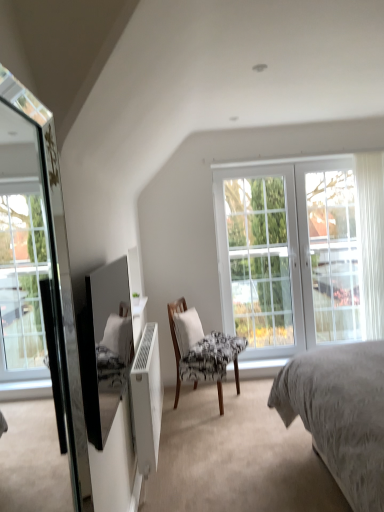
Where is `vacant area in front of wooden chair with patterned fabric at center`? Image resolution: width=384 pixels, height=512 pixels. vacant area in front of wooden chair with patterned fabric at center is located at coordinates (207, 422).